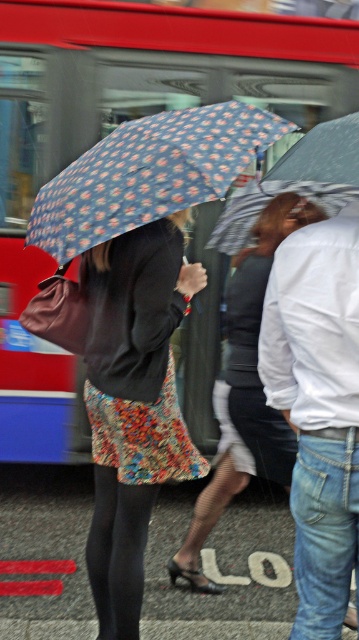
Between red metallic bus at upper left and blue printed fabric umbrella at center, which one appears on the left side from the viewer's perspective?

Positioned to the left is red metallic bus at upper left.

Does point (194, 376) come behind point (234, 128)?

Yes, point (194, 376) is farther from viewer.

Where is `red metallic bus at upper left`? The width and height of the screenshot is (359, 640). red metallic bus at upper left is located at coordinates (113, 129).

Does point (283, 148) come closer to viewer compared to point (226, 248)?

No, (283, 148) is behind (226, 248).

Identify the location of red metallic bus at upper left. (113, 129).

Which is behind, point (141, 189) or point (249, 192)?

The point (249, 192) is more distant.

The image size is (359, 640). What do you see at coordinates (148, 173) in the screenshot? I see `blue printed fabric umbrella at center` at bounding box center [148, 173].

Find the location of a particular element. Image resolution: width=359 pixels, height=640 pixels. blue printed fabric umbrella at center is located at coordinates [148, 173].